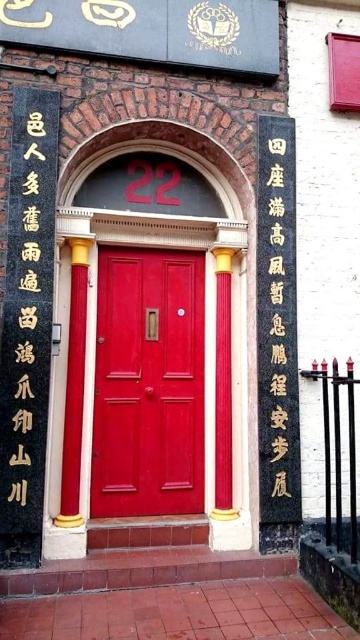
You are an architect designing a similar entrance. You need to place a decorative element between the matte wood door at center and the black stone writing at center. Based on their positions, where should you place it?

Since the matte wood door at center is positioned on the left side of black stone writing at center, you should place the decorative element between them on the right side of the matte wood door at center and the left side of the black stone writing at center.

You are standing in front of the entrance and notice two points marked in the scene. The first point is at coordinates point (150, 385) and the second is at point (19, 515). Which point is closer to you?

Point (19, 515) is closer to you because it is in front of point (150, 385).